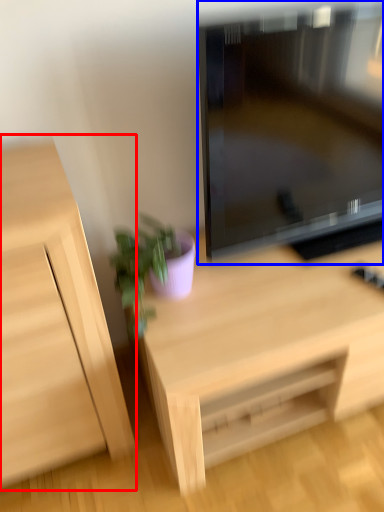
Question: Which point is further to the camera, cabinetry (highlighted by a red box) or television (highlighted by a blue box)?

Choices:
 (A) cabinetry
 (B) television

Answer: (B)